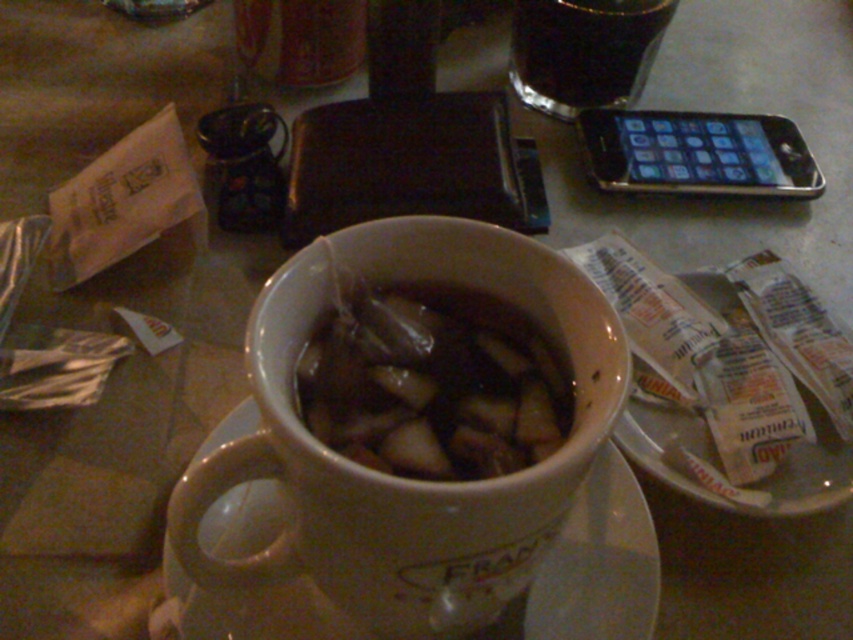
Does white ceramic saucer at center have a greater height compared to dark brown liquid at upper center?

Yes, white ceramic saucer at center is taller than dark brown liquid at upper center.

You are a GUI agent. You are given a task and a screenshot of the screen. Output one action in this format:
    pyautogui.click(x=<x>, y=<y>)
    Task: Click on the white ceramic saucer at center
    This screenshot has width=853, height=640.
    Given the screenshot: What is the action you would take?
    pyautogui.click(x=593, y=566)

I want to click on white ceramic saucer at center, so click(x=593, y=566).

Is point (560, 429) more distant than point (643, 52)?

No.

Who is positioned more to the right, translucent plastic bag at center or dark brown liquid at upper center?

dark brown liquid at upper center is more to the right.

You are a GUI agent. You are given a task and a screenshot of the screen. Output one action in this format:
    pyautogui.click(x=<x>, y=<y>)
    Task: Click on the translucent plastic bag at center
    
    Given the screenshot: What is the action you would take?
    pyautogui.click(x=431, y=385)

Between white ceramic saucer at center and black metallic smartphone at upper right, which one is positioned higher?

black metallic smartphone at upper right is above.

Is white ceramic saucer at center bigger than black metallic smartphone at upper right?

Correct, white ceramic saucer at center is larger in size than black metallic smartphone at upper right.

The image size is (853, 640). What are the coordinates of `white ceramic saucer at center` in the screenshot? It's located at (593, 566).